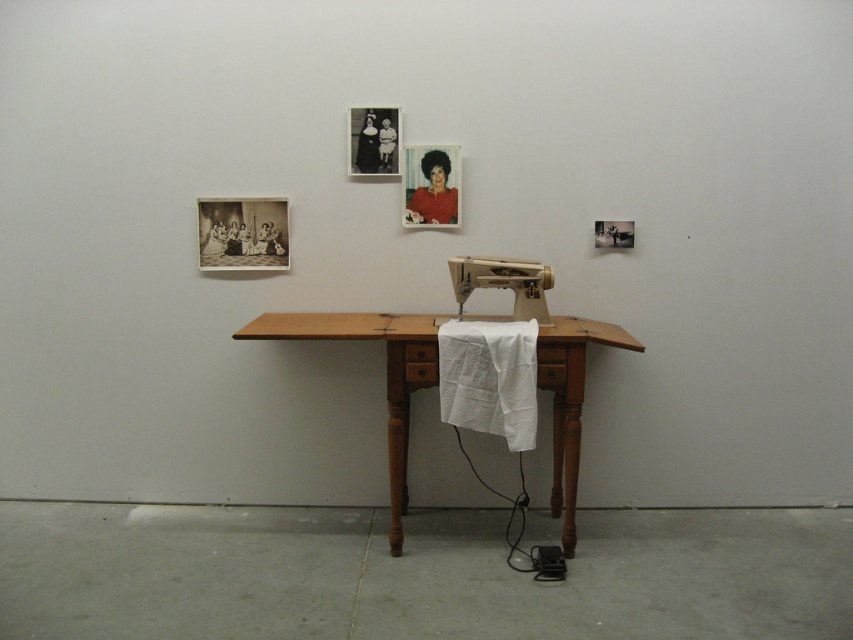
You are an interior designer assessing the space. The client wants to know if the white plastic sewing machine at center will block the view of the black matte photo frame at upper center when placed on the table. Can you determine this based on their sizes?

The white plastic sewing machine at center is taller than the black matte photo frame at upper center, so it will block the view of the photo frame.